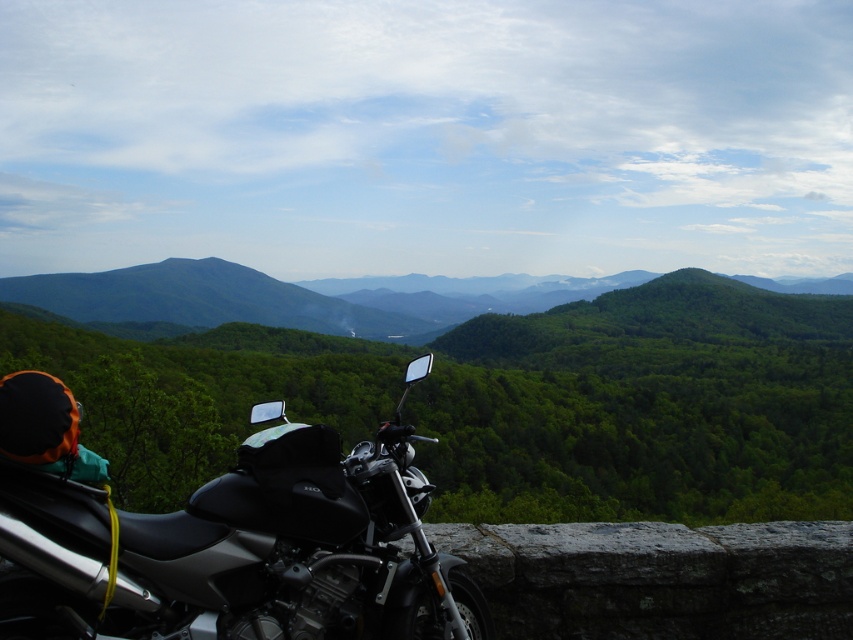
From the picture: You are a photographer planning to capture the green forested mountain at center and the shiny black motorcycle at lower left in a single frame. Considering their sizes in the image, which object will appear larger?

The green forested mountain at center will appear larger in the image because it has a greater height compared to the shiny black motorcycle at lower left.

You are a photographer planning to capture a landscape photo that includes both the green forested mountain at center and the shiny black motorcycle at lower left. Considering their sizes in the frame, which object should you focus on to ensure both are clearly visible?

The green forested mountain at center is bigger than the shiny black motorcycle at lower left, so focusing on the mountain will ensure both are clearly visible as the motorcycle will naturally appear smaller in the frame.